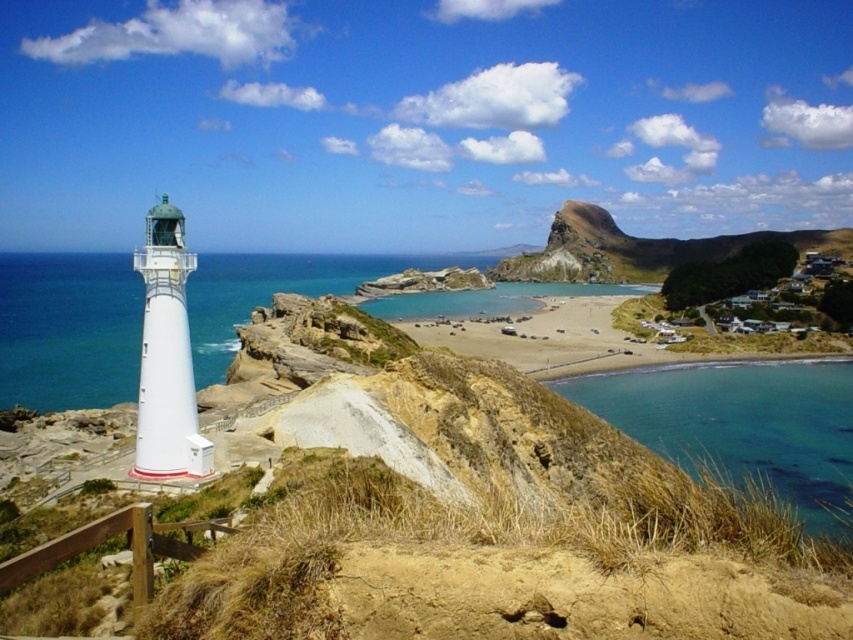
Question: Is clear blue water at lower right wider than smooth sand beach at center?

Choices:
 (A) yes
 (B) no

Answer: (B)

Question: Which point appears closest to the camera in this image?

Choices:
 (A) (550, 365)
 (B) (18, 344)

Answer: (A)

Question: Among these objects, which one is farthest from the camera?

Choices:
 (A) smooth sand beach at center
 (B) white glossy water at left
 (C) clear blue water at lower right

Answer: (A)

Question: Is white glossy water at left above clear blue water at lower right?

Choices:
 (A) yes
 (B) no

Answer: (A)

Question: In this image, where is clear blue water at lower right located relative to smooth sand beach at center?

Choices:
 (A) right
 (B) left

Answer: (A)

Question: Estimate the real-world distances between objects in this image. Which object is closer to the clear blue water at lower right?

Choices:
 (A) white glossy water at left
 (B) smooth sand beach at center

Answer: (B)